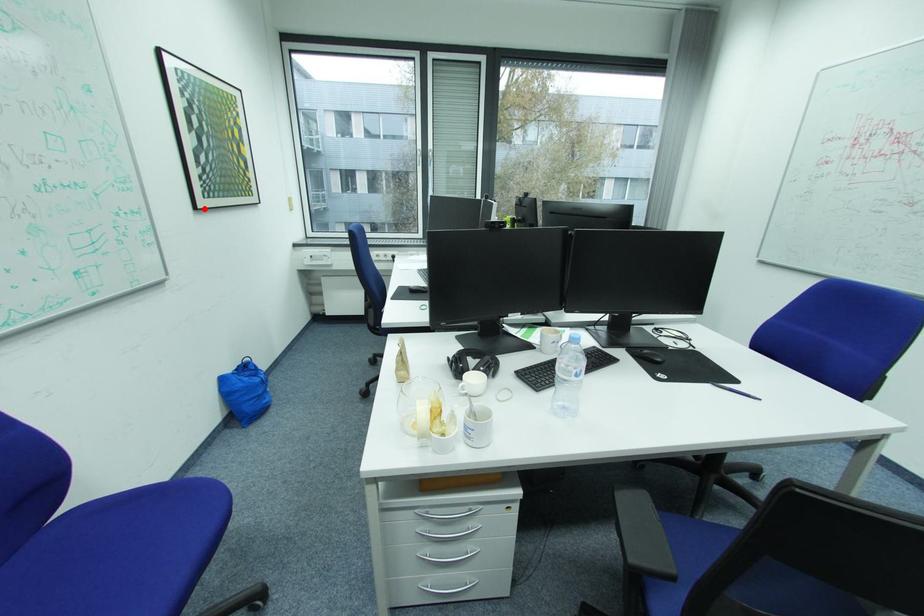
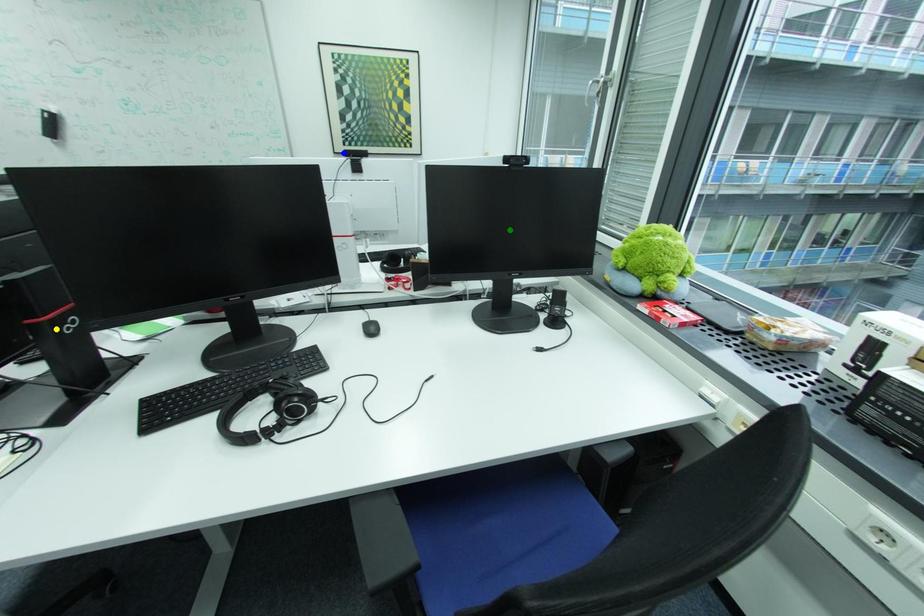
Question: I am providing you with two images of the same scene from different viewpoints. A red point is marked on the first image. You are given multiple points on the second image. Which mark in image 2 goes with the point in image 1?

Choices:
 (A) green point
 (B) yellow point
 (C) blue point

Answer: (C)